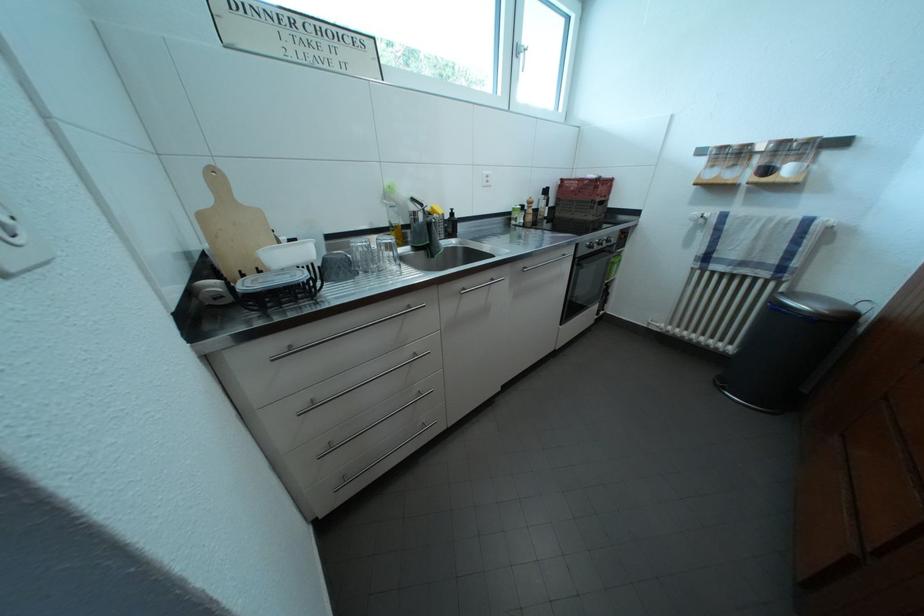
Which object does [585,187] point to?

It refers to a red plastic crate.